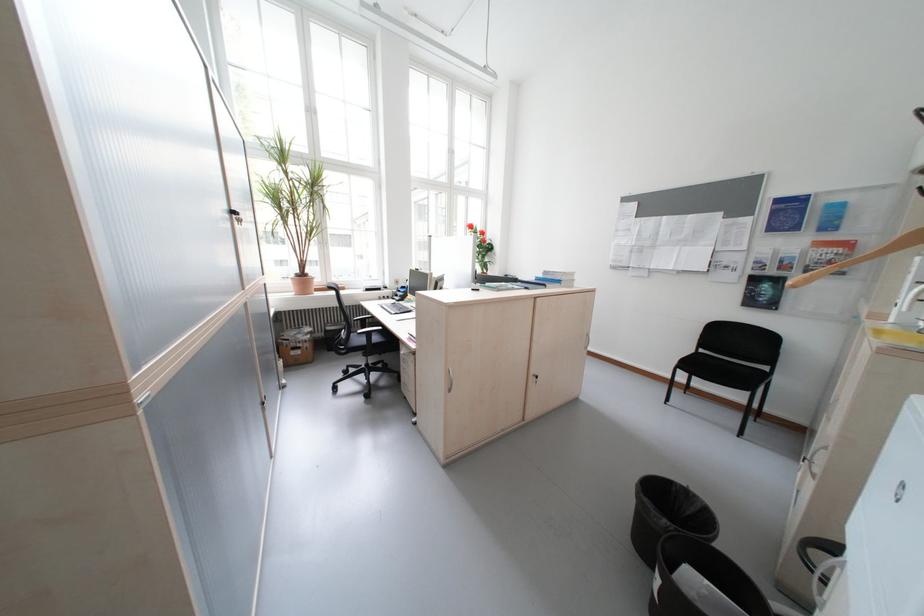
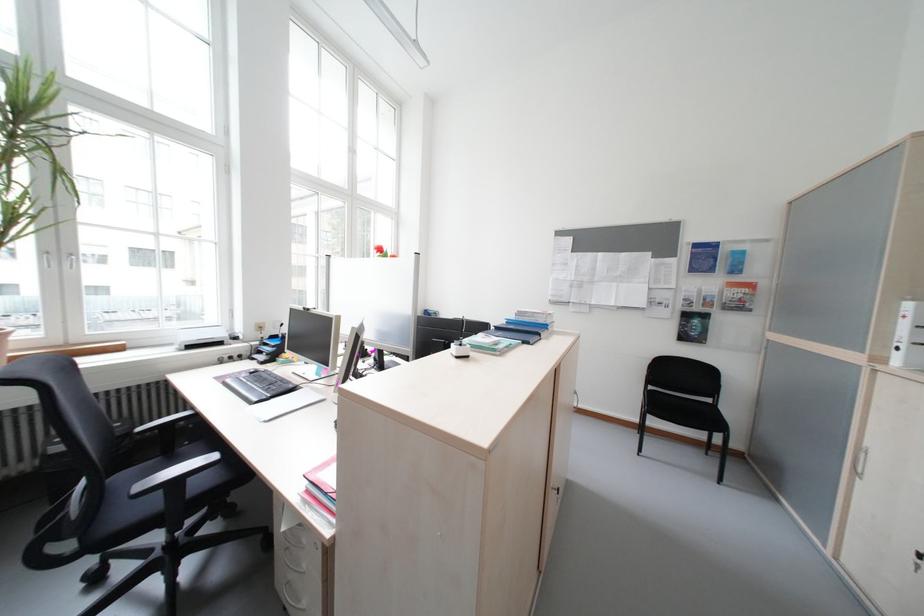
Question: Which direction would the cameraman need to move to produce the second image? Reply with the corresponding letter.

Choices:
 (A) Left
 (B) Right
 (C) Forward
 (D) Backward

Answer: (C)